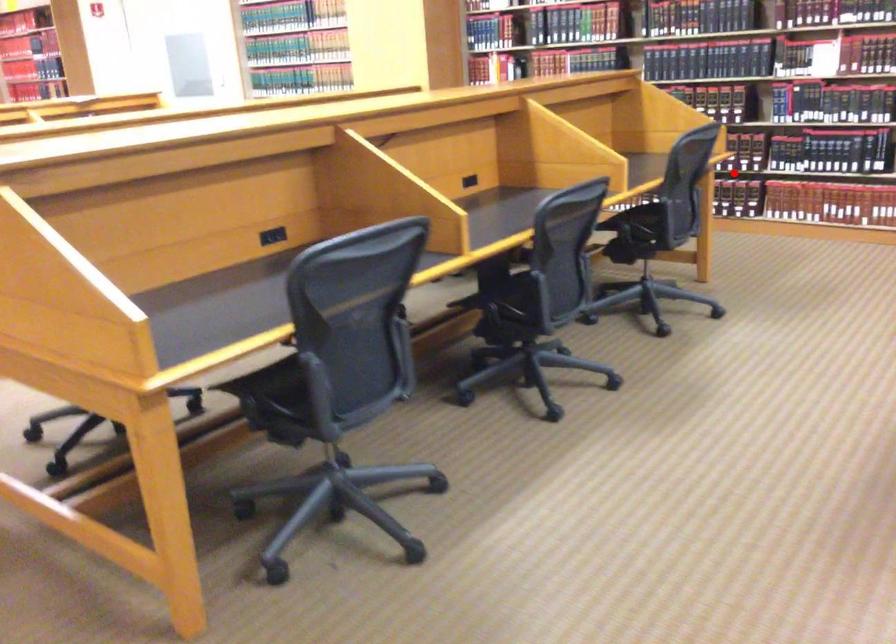
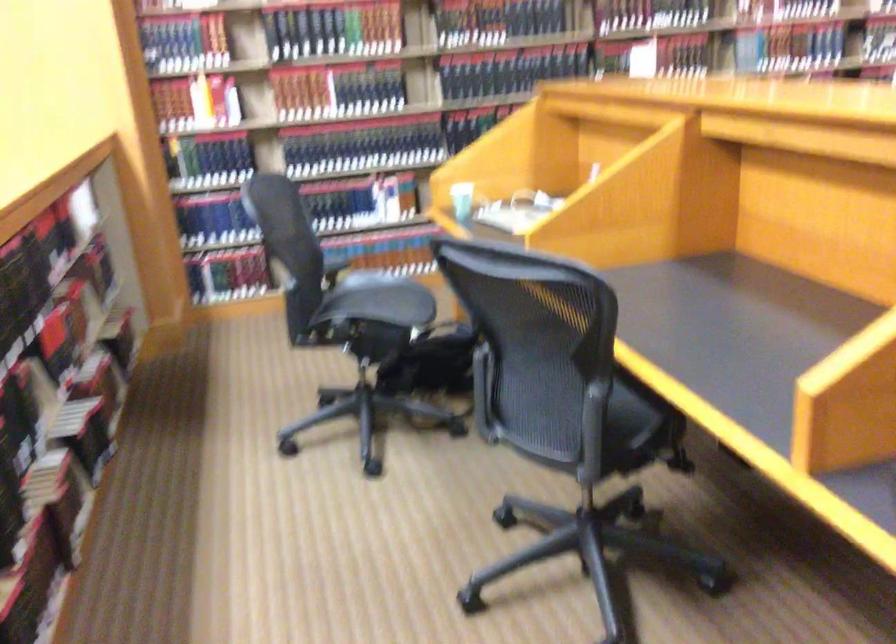
Question: I am providing you with two images of the same scene from different viewpoints. A red point is marked on the first image. At the location where the point appears in image 1, is it still visible in image 2?

Choices:
 (A) Yes
 (B) No

Answer: (B)